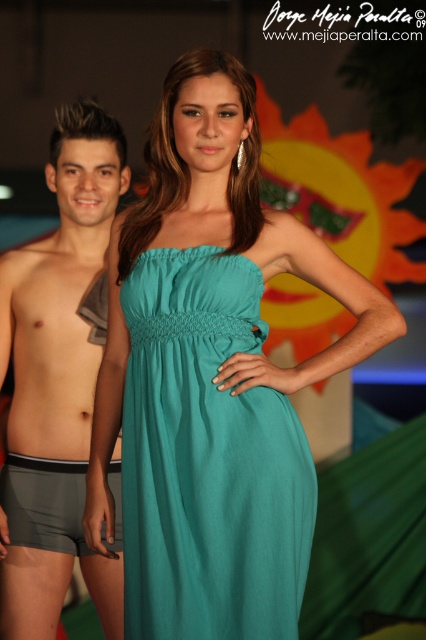
Between teal satin dress at center and skinny gray shorts at left, which one appears on the left side from the viewer's perspective?

From the viewer's perspective, skinny gray shorts at left appears more on the left side.

Is teal satin dress at center shorter than skinny gray shorts at left?

No.

Describe the element at coordinates (207, 460) in the screenshot. The width and height of the screenshot is (426, 640). I see `teal satin dress at center` at that location.

Where is `teal satin dress at center`? This screenshot has height=640, width=426. teal satin dress at center is located at coordinates (207, 460).

Between teal satin dress at center and gray matte shorts at left, which one has more height?

Standing taller between the two is gray matte shorts at left.

Which is behind, point (276, 593) or point (51, 186)?

The point (51, 186) is more distant.

The width and height of the screenshot is (426, 640). What do you see at coordinates (207, 460) in the screenshot? I see `teal satin dress at center` at bounding box center [207, 460].

Locate an element on the screen. teal satin dress at center is located at coordinates (207, 460).

Which of these two, teal fabric dress at center or gray fabric shorts at lower left, stands taller?

teal fabric dress at center is taller.

Can you confirm if teal fabric dress at center is bigger than gray fabric shorts at lower left?

Correct, teal fabric dress at center is larger in size than gray fabric shorts at lower left.

Who is more forward, (359, 284) or (51, 460)?

Point (359, 284) is more forward.

Identify the location of teal fabric dress at center. This screenshot has width=426, height=640. (212, 376).